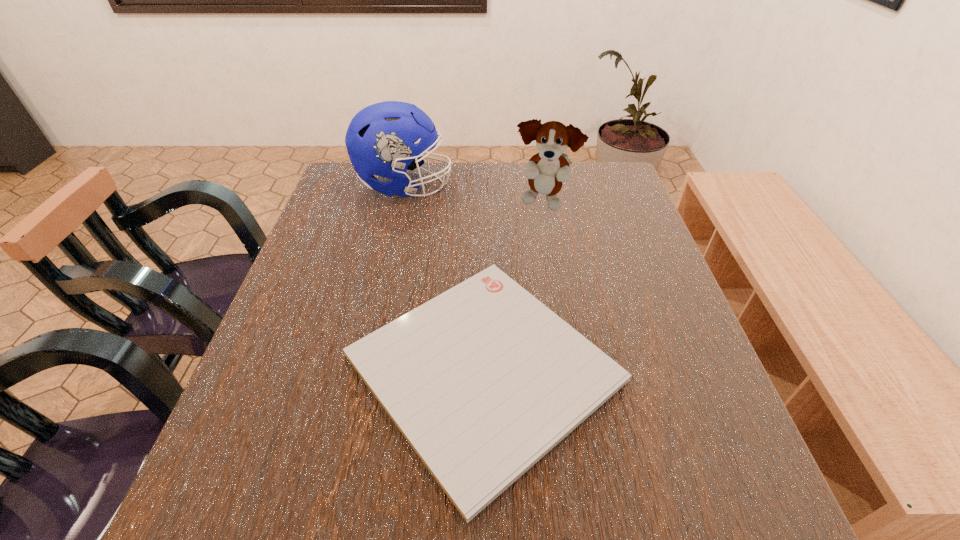
You are a GUI agent. You are given a task and a screenshot of the screen. Output one action in this format:
    pyautogui.click(x=<x>, y=<y>)
    Task: Click on the blank space that satisfies the following two spatial constraints: 1. on the face guard of the football helmet; 2. on the left side of the shortest object
    The height and width of the screenshot is (540, 960).
    Given the screenshot: What is the action you would take?
    pyautogui.click(x=363, y=368)

Find the location of a particular element. vacant point that satisfies the following two spatial constraints: 1. on the face guard of the clipboard; 2. on the right side of the football helmet is located at coordinates (363, 368).

You are a GUI agent. You are given a task and a screenshot of the screen. Output one action in this format:
    pyautogui.click(x=<x>, y=<y>)
    Task: Click on the free space that satisfies the following two spatial constraints: 1. on the face guard of the football helmet; 2. on the back side of the shortest object
    This screenshot has height=540, width=960.
    Given the screenshot: What is the action you would take?
    pyautogui.click(x=363, y=368)